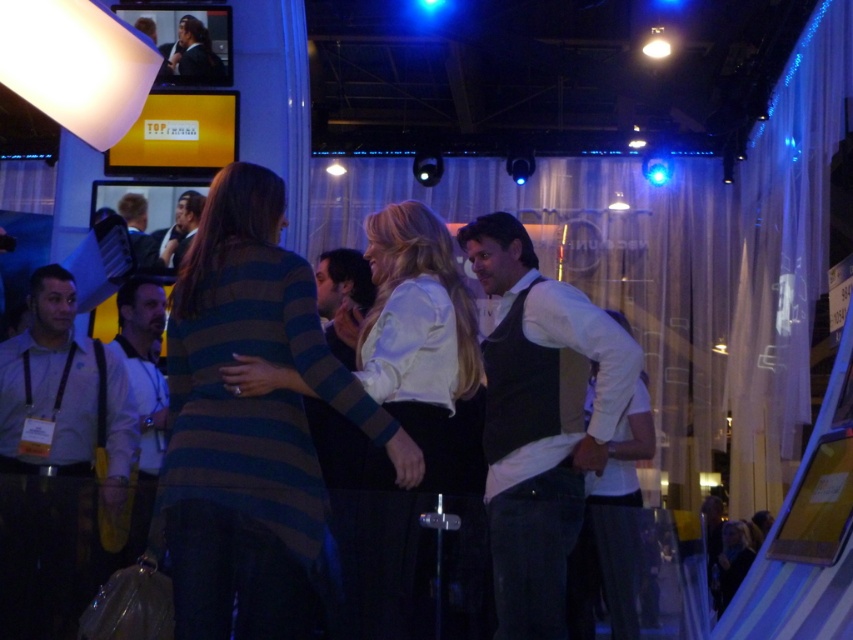
From the picture: You are attending a conference and need to locate two specific attendees based on their clothing. You see the light brown leather jacket at left and the dark suit at center. Which of these two has a taller silhouette?

The light brown leather jacket at left has a greater height compared to the dark suit at center, so the light brown leather jacket at left is taller.

You are organizing a photo shoot and need to place two outfits in the scene described. The light brown leather jacket at left and the dark suit at center are already positioned. If you want to ensure both outfits are visible in the final shot, which outfit should be placed closer to the camera to maintain visibility given their sizes?

The light brown leather jacket at left should be placed closer to the camera because it is wider than the dark suit at center, ensuring both outfits remain visible in the photo.

Consider the image. You are attending an event and want to take a photo of the white satin blouse at center and the matte black vest at center. To ensure both are in focus, where should you position your camera relative to their vertical positions?

Position the camera so it is aligned with the vertical midpoint between the white satin blouse at center and the matte black vest at center. Since the white satin blouse at center is below the matte black vest at center, centering the camera between their positions will keep both in focus.